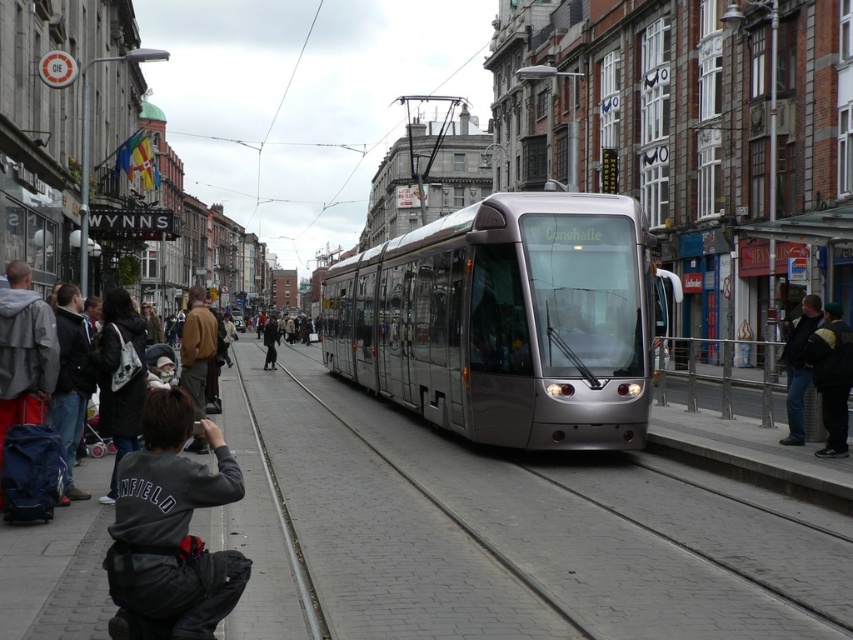
What are the coordinates of the metallic silver tram at center?

The coordinates of the metallic silver tram at center are at point (506, 321).

You are a pedestrian standing on the street looking at the dark gray sweatshirt at lower left and the black leather jacket at lower right. Which one is shorter in height?

The dark gray sweatshirt at lower left has a lesser height compared to the black leather jacket at lower right, so the dark gray sweatshirt at lower left is shorter.

You are a pedestrian standing on the sidewalk and see the metallic silver tram at center and the dark gray jacket at center. Which object appears smaller in the image?

The metallic silver tram at center appears smaller than the dark gray jacket at center in the image.